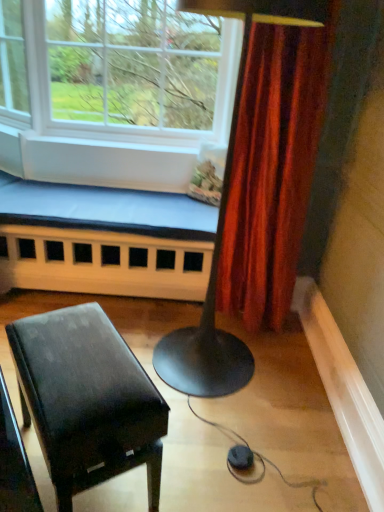
Question: Considering the relative positions of clear glass window at upper left and white wood church bench at lower left in the image provided, is clear glass window at upper left to the left or to the right of white wood church bench at lower left?

Choices:
 (A) left
 (B) right

Answer: (A)

Question: From a real-world perspective, relative to white wood church bench at lower left, is clear glass window at upper left vertically above or below?

Choices:
 (A) below
 (B) above

Answer: (B)

Question: Considering the real-world distances, which object is closest to the white wood church bench at lower left?

Choices:
 (A) clear glass window at upper left
 (B) glossy black piano at lower left

Answer: (A)

Question: Estimate the real-world distances between objects in this image. Which object is closer to the clear glass window at upper left?

Choices:
 (A) glossy black piano at lower left
 (B) white wood church bench at lower left

Answer: (B)